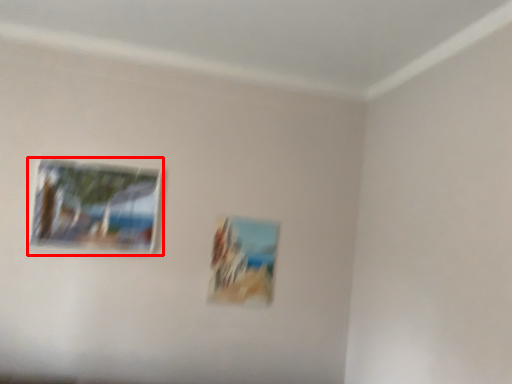
Question: In this image, where is picture frame (annotated by the red box) located relative to picture frame?

Choices:
 (A) right
 (B) left

Answer: (B)